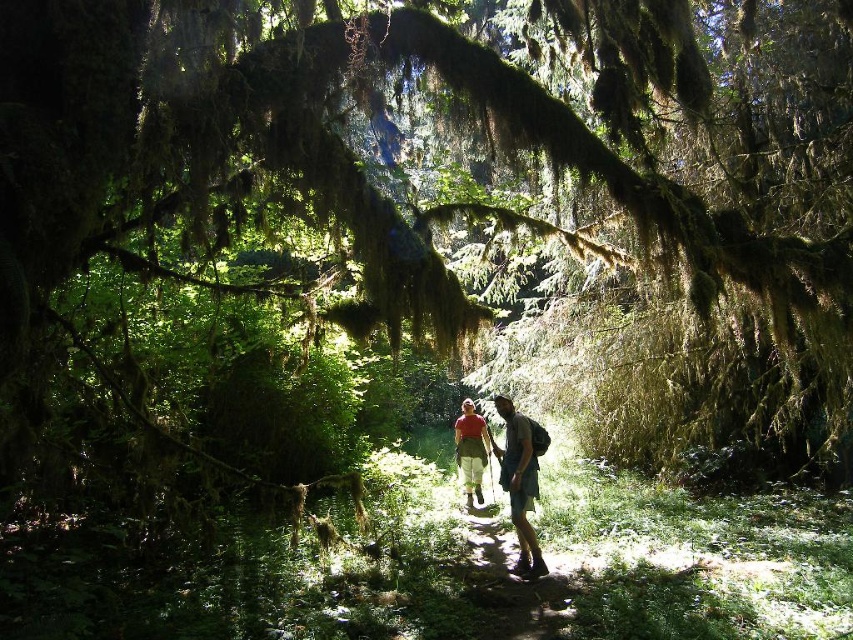
Question: Considering the relative positions of matte green shorts at center and matte red shirt at center in the image provided, where is matte green shorts at center located with respect to matte red shirt at center?

Choices:
 (A) right
 (B) left

Answer: (A)

Question: Can you confirm if matte green shorts at center is positioned above matte red shirt at center?

Choices:
 (A) no
 (B) yes

Answer: (A)

Question: Which point is closer to the camera?

Choices:
 (A) matte red shirt at center
 (B) matte green shorts at center

Answer: (B)

Question: Is matte green shorts at center below matte red shirt at center?

Choices:
 (A) yes
 (B) no

Answer: (A)